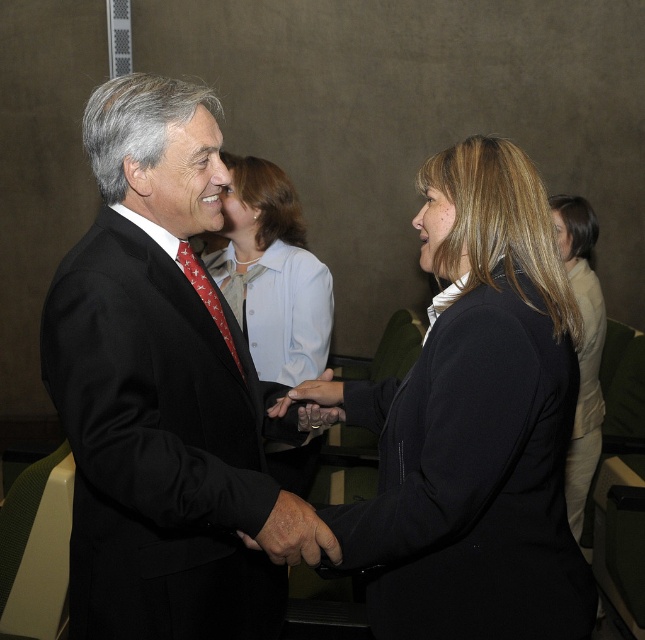
Can you confirm if leather-like skin at center is wider than matte black hand at center?

Yes, leather-like skin at center is wider than matte black hand at center.

From the picture: Which is more to the right, leather-like skin at center or matte black hand at center?

Positioned to the right is matte black hand at center.

Does point (303, 538) come farther from viewer compared to point (315, 387)?

No.

Locate an element on the screen. leather-like skin at center is located at coordinates (293, 532).

Is point (199, 193) farther from camera compared to point (239, 236)?

No.

Which is behind, point (233, 509) or point (224, 292)?

Positioned behind is point (224, 292).

Where is `black suit at center`? black suit at center is located at coordinates (161, 387).

Who is positioned more to the right, leather-like skin at center or red silk tie at center?

leather-like skin at center

Is leather-like skin at center closer to the viewer compared to red silk tie at center?

Yes, it is in front of red silk tie at center.

The image size is (645, 640). Identify the location of leather-like skin at center. (293, 532).